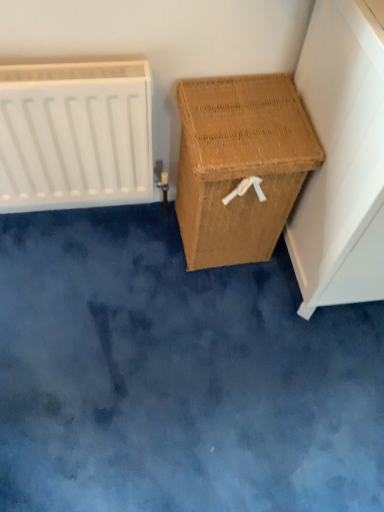
Question: Is white matte radiator at left beside woven brown laundry basket at right, which is the second furniture in left-to-right order?

Choices:
 (A) yes
 (B) no

Answer: (B)

Question: Is woven brown laundry basket at right, the 1th furniture in the right-to-left sequence, at the back of white matte radiator at left?

Choices:
 (A) no
 (B) yes

Answer: (A)

Question: From the image's perspective, is white matte radiator at left located above woven brown laundry basket at right, which is the second furniture in left-to-right order?

Choices:
 (A) no
 (B) yes

Answer: (B)

Question: Is white matte radiator at left shorter than woven brown laundry basket at right, the 1th furniture in the right-to-left sequence?

Choices:
 (A) no
 (B) yes

Answer: (B)

Question: Can you confirm if white matte radiator at left is taller than woven brown laundry basket at right, the 1th furniture in the right-to-left sequence?

Choices:
 (A) no
 (B) yes

Answer: (A)

Question: Is white matte radiator at left smaller than woven brown laundry basket at right, which is the second furniture in left-to-right order?

Choices:
 (A) no
 (B) yes

Answer: (B)

Question: From the image's perspective, would you say woven brown laundry basket at right, the 1th furniture in the right-to-left sequence, is positioned over white matte radiator at left?

Choices:
 (A) yes
 (B) no

Answer: (B)

Question: Is white matte radiator at left inside woven brown laundry basket at right, the 1th furniture in the right-to-left sequence?

Choices:
 (A) no
 (B) yes

Answer: (A)

Question: Is woven brown laundry basket at right, which is the second furniture in left-to-right order, facing towards white matte radiator at left?

Choices:
 (A) yes
 (B) no

Answer: (B)

Question: Is woven brown laundry basket at right, the 1th furniture in the right-to-left sequence, at the right side of white matte radiator at left?

Choices:
 (A) yes
 (B) no

Answer: (A)

Question: Is woven brown laundry basket at right, which is the second furniture in left-to-right order, turned away from white matte radiator at left?

Choices:
 (A) yes
 (B) no

Answer: (B)

Question: Can you confirm if woven brown laundry basket at right, the 1th furniture in the right-to-left sequence, is shorter than white matte radiator at left?

Choices:
 (A) yes
 (B) no

Answer: (B)

Question: Is woven brown basket at right, marked as the second furniture in a right-to-left arrangement, oriented away from white matte radiator at left?

Choices:
 (A) no
 (B) yes

Answer: (A)